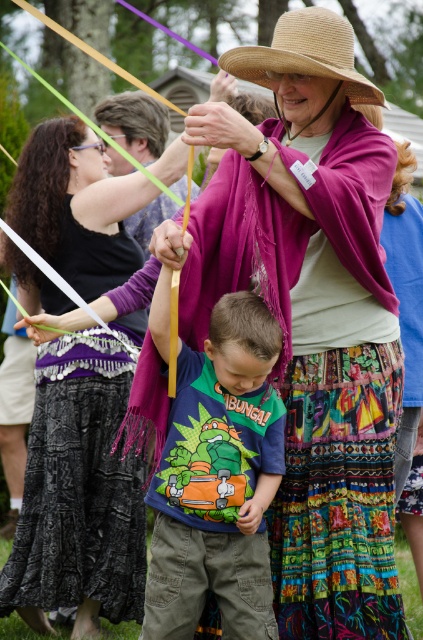
Question: Can you confirm if black textured skirt at lower left is smaller than straw hat at upper center?

Choices:
 (A) yes
 (B) no

Answer: (B)

Question: Does straw hat at center have a larger size compared to straw hat at upper center?

Choices:
 (A) yes
 (B) no

Answer: (A)

Question: Which object is farther from the camera taking this photo?

Choices:
 (A) black textured skirt at lower left
 (B) purple scarf at upper center
 (C) purple scarf at center

Answer: (A)

Question: Does purple scarf at center have a greater width compared to straw hat at upper center?

Choices:
 (A) yes
 (B) no

Answer: (A)

Question: Based on their relative distances, which object is nearer to the straw hat at upper center?

Choices:
 (A) matte green t-shirt at center
 (B) purple scarf at upper center

Answer: (B)

Question: Which object is farther from the camera taking this photo?

Choices:
 (A) straw hat at center
 (B) purple scarf at upper center

Answer: (A)